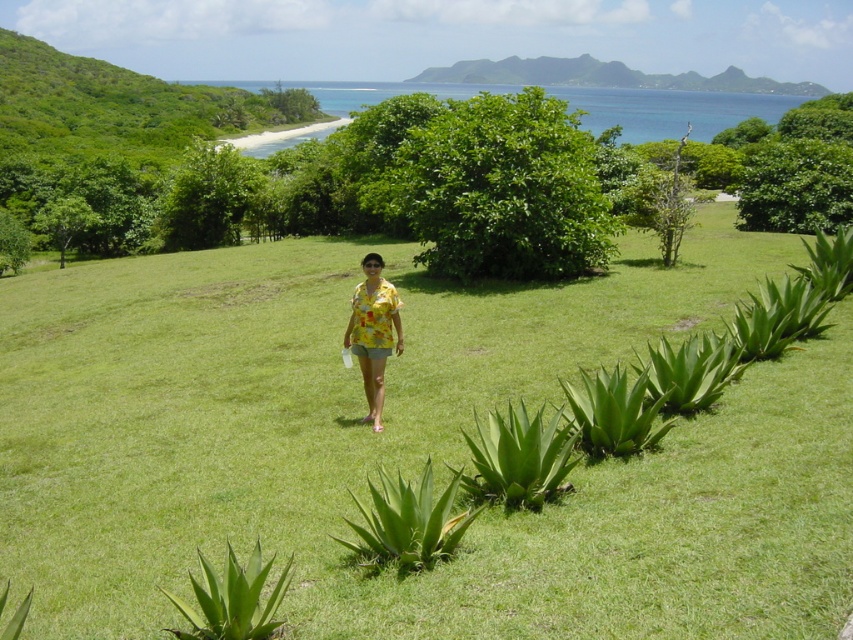
You are standing at the point labeled as point (410, 445) in the image. What is the immediate surface you are standing on?

The immediate surface at point (410, 445) is green grassy at center.

You are standing in the tropical landscape and want to take a photo of both the green grassy at center and the green leafy hillside at upper center. Which object should you adjust your camera to focus on first to ensure both are in the frame?

You should focus on the green leafy hillside at upper center first because the green grassy at center is positioned on its left side, so adjusting the camera to include the hillside will naturally include the grassy area as well.

You are standing in the tropical landscape and want to take a photo of the green leafy hillside at upper center. Based on its position, where should you aim your camera to capture it in the frame?

The green leafy hillside at upper center is located at point coordinates approximately 0.119 on the horizontal axis and 0.710 on the vertical axis, so aim your camera slightly to the left and towards the upper part of the frame to capture it.